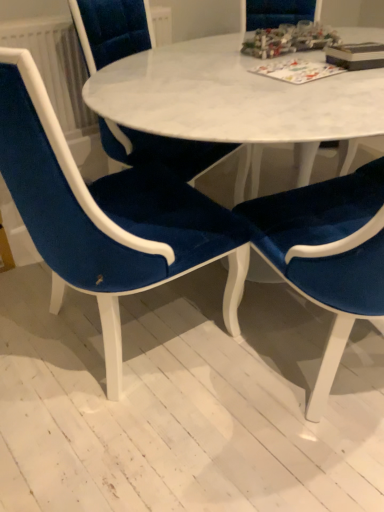
Question: Is white textured radiator at upper left wider or thinner than velvet blue chair at center, which is the second chair from left to right?

Choices:
 (A) wide
 (B) thin

Answer: (B)

Question: Is white textured radiator at upper left taller or shorter than velvet blue chair at center, which is the second chair from left to right?

Choices:
 (A) short
 (B) tall

Answer: (A)

Question: Which object is the closest to the hardcover book at upper right, the 2th book in the left-to-right sequence?

Choices:
 (A) matte paper board game at upper center, acting as the first book starting from the left
 (B) white textured radiator at upper left
 (C) velvet blue chair at center, the third chair positioned from the left
 (D) velvet blue chair at lower left, which is the 1th chair from left to right
 (E) velvet blue chair at center, the 2th chair viewed from the right

Answer: (A)

Question: Considering the real-world distances, which object is farthest from the velvet blue chair at center, the third chair positioned from the left?

Choices:
 (A) velvet blue chair at center, which is the second chair from left to right
 (B) white textured radiator at upper left
 (C) velvet blue chair at lower left, which is the 1th chair from left to right
 (D) matte paper board game at upper center, the 2th book from the right
 (E) hardcover book at upper right, which is the 1th book in right-to-left order

Answer: (B)